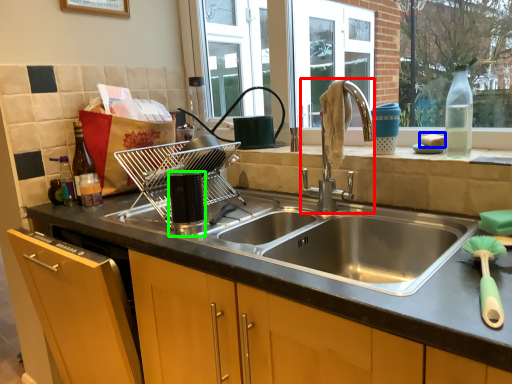
Question: Which object is the farthest from tap (highlighted by a red box)? Choose among these: food (highlighted by a blue box) or appliance (highlighted by a green box).

Choices:
 (A) food
 (B) appliance

Answer: (B)